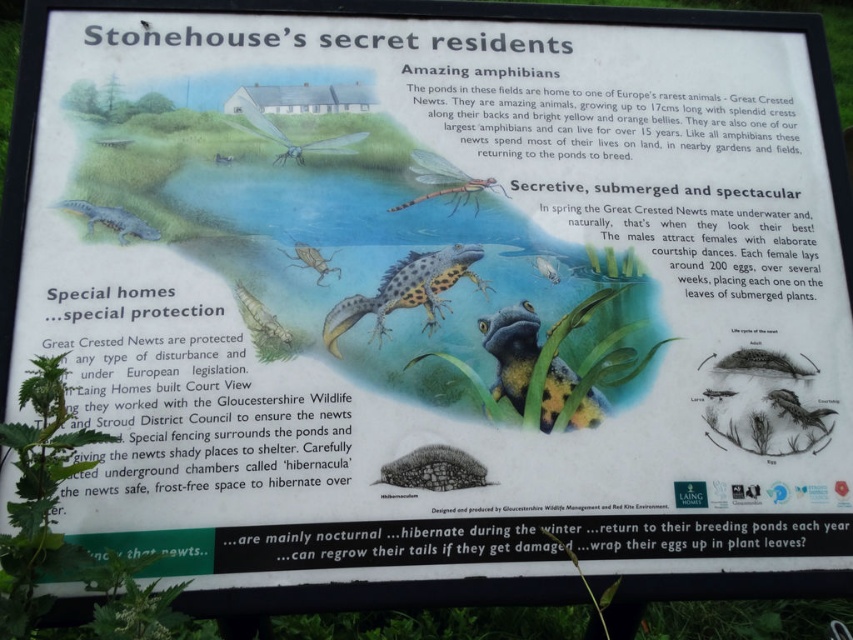
Question: Among these objects, which one is nearest to the camera?

Choices:
 (A) translucent blue dragonfly at upper center
 (B) spotted green frog at lower left

Answer: (B)

Question: From the image, what is the correct spatial relationship of shiny blue frog at center in relation to translucent orange dragonfly at upper center?

Choices:
 (A) left
 (B) right

Answer: (B)

Question: Does translucent orange dragonfly at upper center have a greater width compared to matte brown insect at center?

Choices:
 (A) yes
 (B) no

Answer: (A)

Question: Among these points, which one is farthest from the camera?

Choices:
 (A) (500, 390)
 (B) (485, 476)

Answer: (A)

Question: Is translucent orange dragonfly at upper center below spotted green frog at lower left?

Choices:
 (A) no
 (B) yes

Answer: (A)

Question: Which of the following is the closest to the observer?

Choices:
 (A) matte brown insect at center
 (B) translucent orange dragonfly at upper center
 (C) translucent greenish fish at center

Answer: (C)